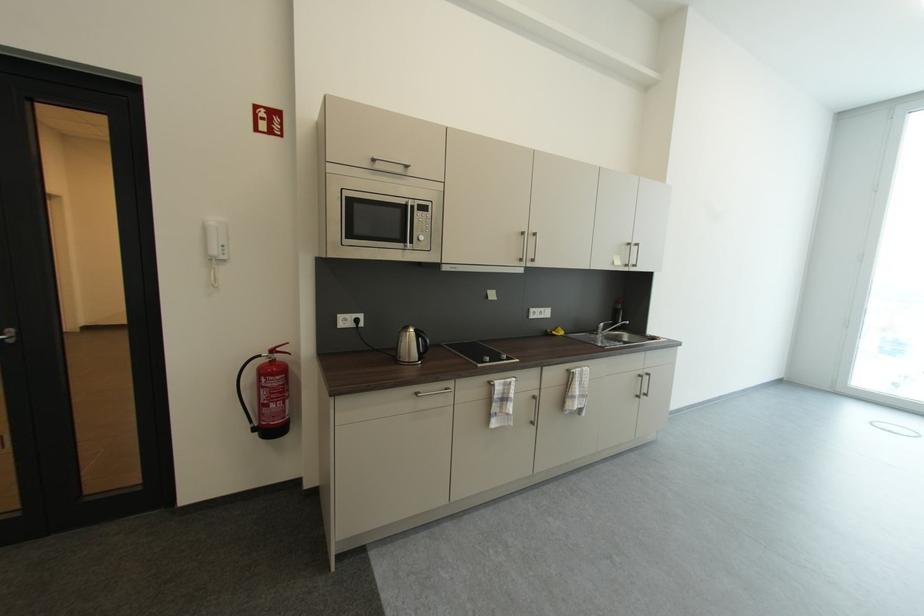
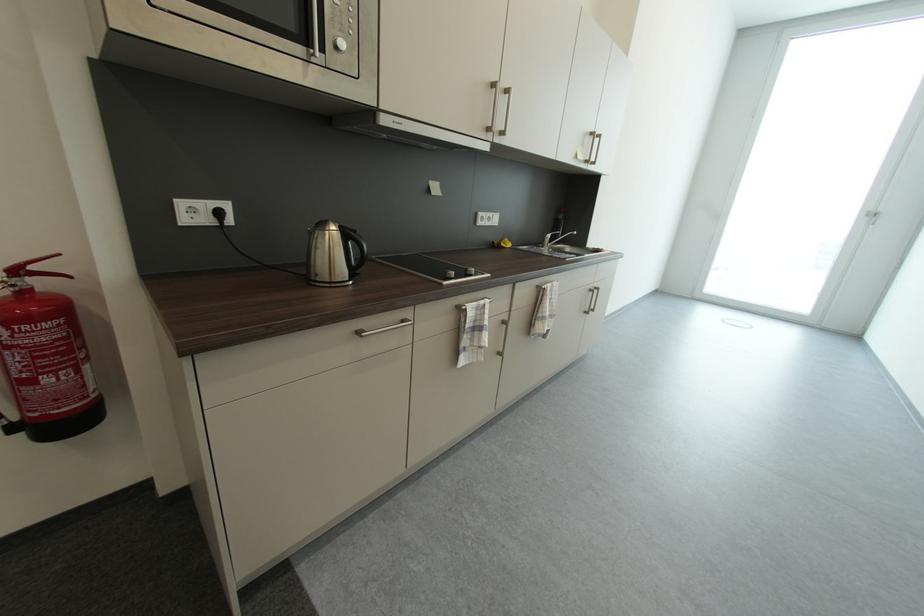
Where in the second image is the point corresponding to point 603,330 from the first image?

(550, 241)